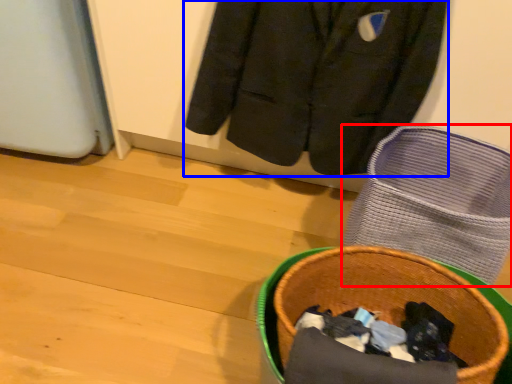
Question: Which object is further to the camera taking this photo, footwear (highlighted by a red box) or jacket (highlighted by a blue box)?

Choices:
 (A) footwear
 (B) jacket

Answer: (B)